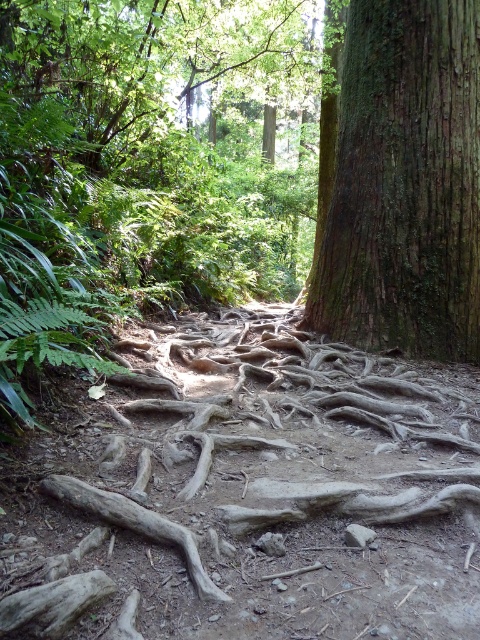
Question: Observing the image, what is the correct spatial positioning of green rough bark tree trunk at center in reference to brown rough tree root at lower left?

Choices:
 (A) above
 (B) below

Answer: (A)

Question: Is green rough bark tree trunk at center wider than brown rough tree root at lower left?

Choices:
 (A) no
 (B) yes

Answer: (B)

Question: From the image, what is the correct spatial relationship of green rough bark tree trunk at center in relation to brown rough tree root at lower left?

Choices:
 (A) right
 (B) left

Answer: (A)

Question: Which object appears closest to the camera in this image?

Choices:
 (A) green rough bark tree trunk at center
 (B) brown rough tree root at lower left

Answer: (B)